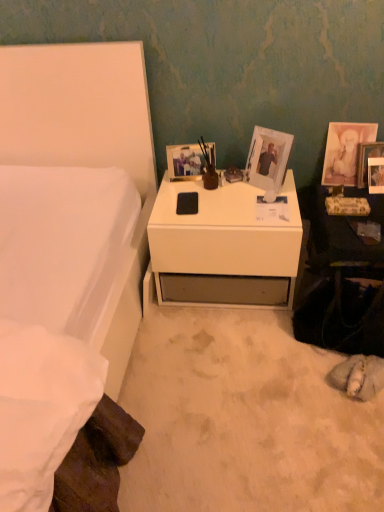
Question: Would you say white matte bed at left is a long distance from matte white picture frame at upper right, the 3th picture frame from the left?

Choices:
 (A) no
 (B) yes

Answer: (B)

Question: Is white matte bed at left further to camera compared to matte white picture frame at upper right, the 3th picture frame from the left?

Choices:
 (A) no
 (B) yes

Answer: (A)

Question: Is white matte bed at left at the left side of matte white picture frame at upper right, the 3th picture frame from the left?

Choices:
 (A) yes
 (B) no

Answer: (A)

Question: From the image's perspective, is white matte bed at left on top of matte white picture frame at upper right, the 3th picture frame from the left?

Choices:
 (A) no
 (B) yes

Answer: (A)

Question: Considering the relative sizes of white matte bed at left and matte white picture frame at upper right, the 3th picture frame from the left, in the image provided, is white matte bed at left smaller than matte white picture frame at upper right, the 3th picture frame from the left,?

Choices:
 (A) yes
 (B) no

Answer: (B)

Question: From the image's perspective, is white matte bed at left positioned above or below white plastic picture frame at upper center, acting as the 3th picture frame starting from the right?

Choices:
 (A) below
 (B) above

Answer: (A)

Question: In the image, is white matte bed at left on the left side or the right side of white plastic picture frame at upper center, the second picture frame in the left-to-right sequence?

Choices:
 (A) left
 (B) right

Answer: (A)

Question: In terms of width, does white matte bed at left look wider or thinner when compared to white plastic picture frame at upper center, the second picture frame in the left-to-right sequence?

Choices:
 (A) wide
 (B) thin

Answer: (A)

Question: Looking at the image, does white matte bed at left seem bigger or smaller compared to white plastic picture frame at upper center, the second picture frame in the left-to-right sequence?

Choices:
 (A) big
 (B) small

Answer: (A)

Question: From the image's perspective, is white matte bed at left positioned above or below green floral magazine at right?

Choices:
 (A) below
 (B) above

Answer: (A)

Question: Is white matte bed at left wider or thinner than green floral magazine at right?

Choices:
 (A) wide
 (B) thin

Answer: (A)

Question: Does point (61, 48) appear closer or farther from the camera than point (352, 215)?

Choices:
 (A) closer
 (B) farther

Answer: (B)

Question: From their relative heights in the image, would you say white matte bed at left is taller or shorter than green floral magazine at right?

Choices:
 (A) short
 (B) tall

Answer: (B)

Question: In the image, is matte white picture frame at upper right, the 4th picture frame in the left-to-right sequence, on the left side or the right side of white matte desk at center?

Choices:
 (A) left
 (B) right

Answer: (B)

Question: From a real-world perspective, is matte white picture frame at upper right, the 4th picture frame in the left-to-right sequence, above or below white matte desk at center?

Choices:
 (A) above
 (B) below

Answer: (A)